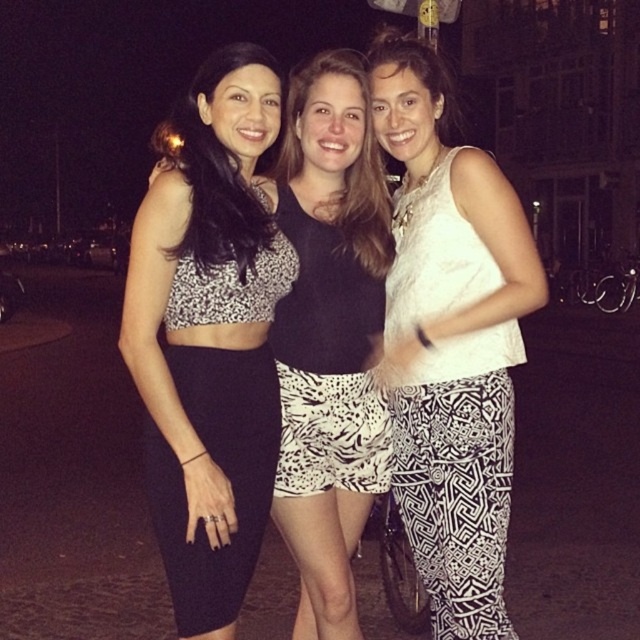
You are a photographer trying to adjust the focus of your camera. You want to ensure both the white lace top at center and the black printed fabric dress at left are in focus. Which one should you focus on first to achieve this?

You should focus on the white lace top at center first because it is located above the black printed fabric dress at left, so focusing on the closer object will ensure both are in focus.